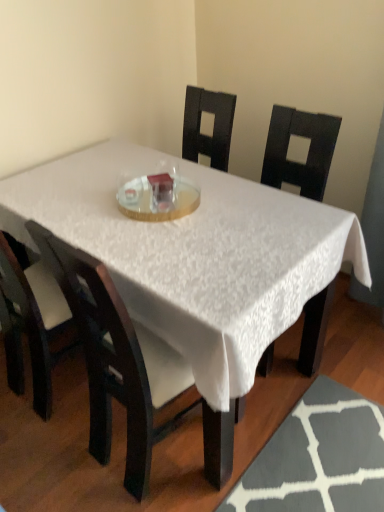
Locate an element on the screen. vacant space in front of clear glass plate at center is located at coordinates (161, 241).